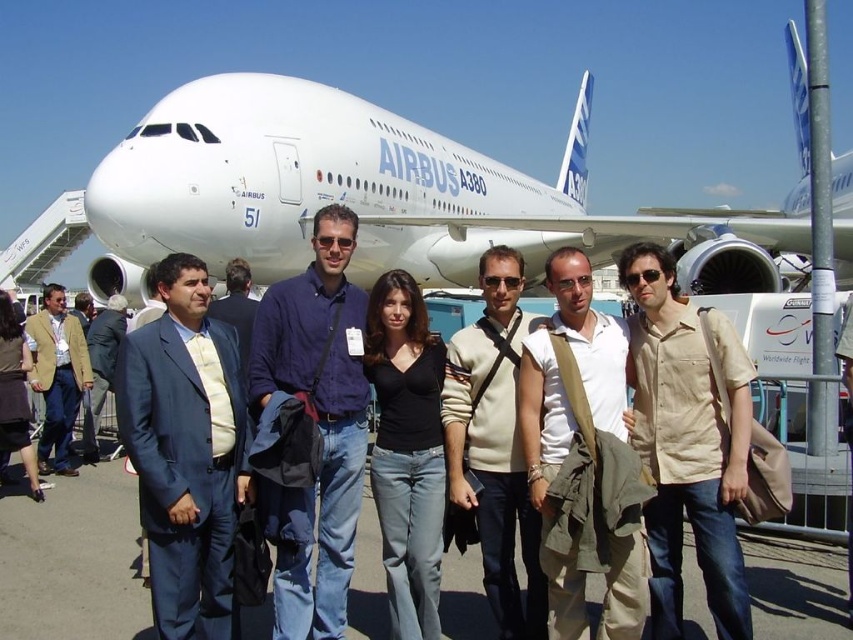
Where is `smooth concrete tarmac at center`? smooth concrete tarmac at center is located at coordinates (73, 561).

Is point (138, 611) behind point (207, 556)?

Yes, it is behind point (207, 556).

Who is more forward, (131, 592) or (135, 451)?

Positioned in front is point (135, 451).

You are a GUI agent. You are given a task and a screenshot of the screen. Output one action in this format:
    pyautogui.click(x=<x>, y=<y>)
    Task: Click on the smooth concrete tarmac at center
    Image resolution: width=853 pixels, height=640 pixels.
    Given the screenshot: What is the action you would take?
    pyautogui.click(x=73, y=561)

In the scene shown: Who is shorter, white glossy airplane at upper center or beige cotton shirt at center?

With less height is beige cotton shirt at center.

Consider the image. Measure the distance between white glossy airplane at upper center and camera.

white glossy airplane at upper center is 14.54 meters from camera.

The image size is (853, 640). I want to click on white glossy airplane at upper center, so click(x=310, y=173).

Does matte blue suit at center have a lesser width compared to beige sweater at center?

No, matte blue suit at center is not thinner than beige sweater at center.

You are a GUI agent. You are given a task and a screenshot of the screen. Output one action in this format:
    pyautogui.click(x=<x>, y=<y>)
    Task: Click on the matte blue suit at center
    The height and width of the screenshot is (640, 853).
    Given the screenshot: What is the action you would take?
    pyautogui.click(x=186, y=451)